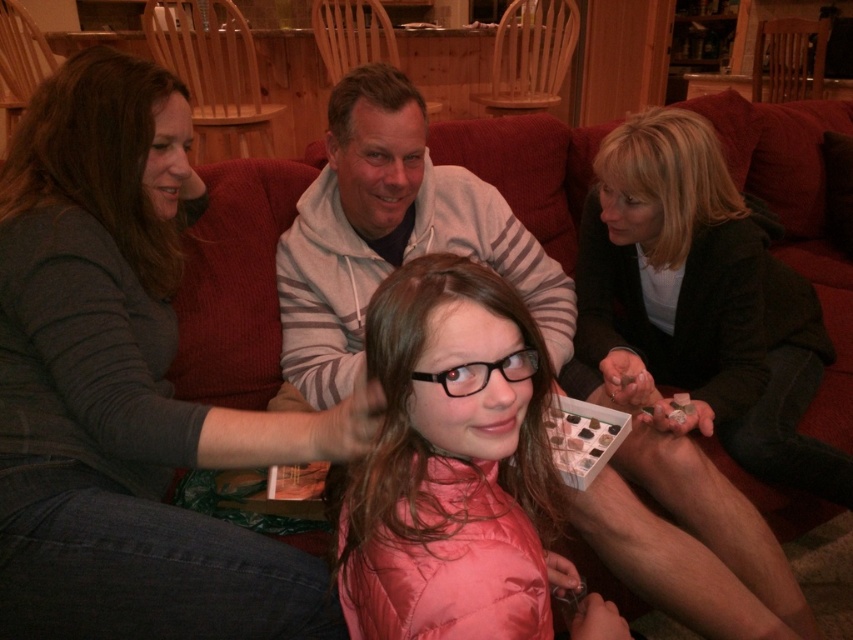
You are a photographer trying to capture a candid shot of the gray hoodie at center and the wooden armchair at upper center. Which object is positioned lower in the frame?

The gray hoodie at center is positioned below the wooden armchair at upper center, so it is lower in the frame.

You are a delivery person carrying a package that requires a 60 cm clearance to pass through the space between the pink quilted jacket at center and the gray striped hoodie at center. Can you safely navigate through this gap with the package?

The gap between the pink quilted jacket at center and the gray striped hoodie at center is 64.99 centimeters, which is wider than the required 60 cm clearance. Therefore, you can safely navigate through the gap with the package.